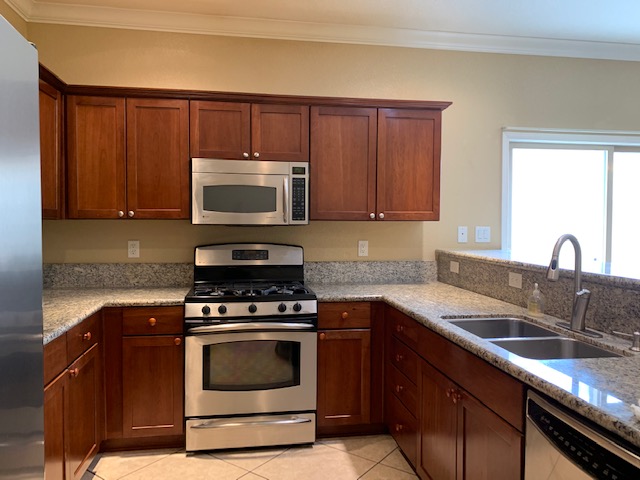
Find the location of `right side of refrigerator door`. right side of refrigerator door is located at coordinates (20, 269).